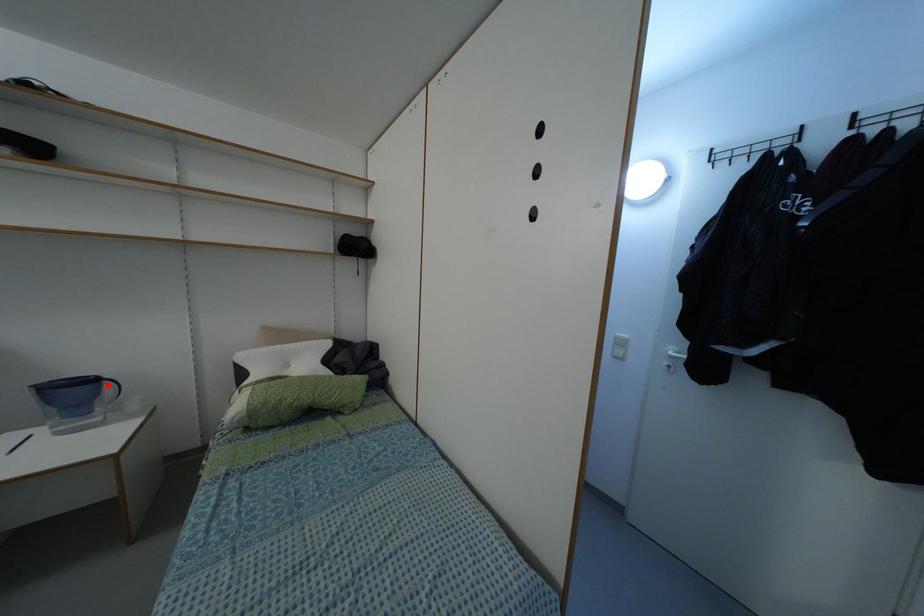
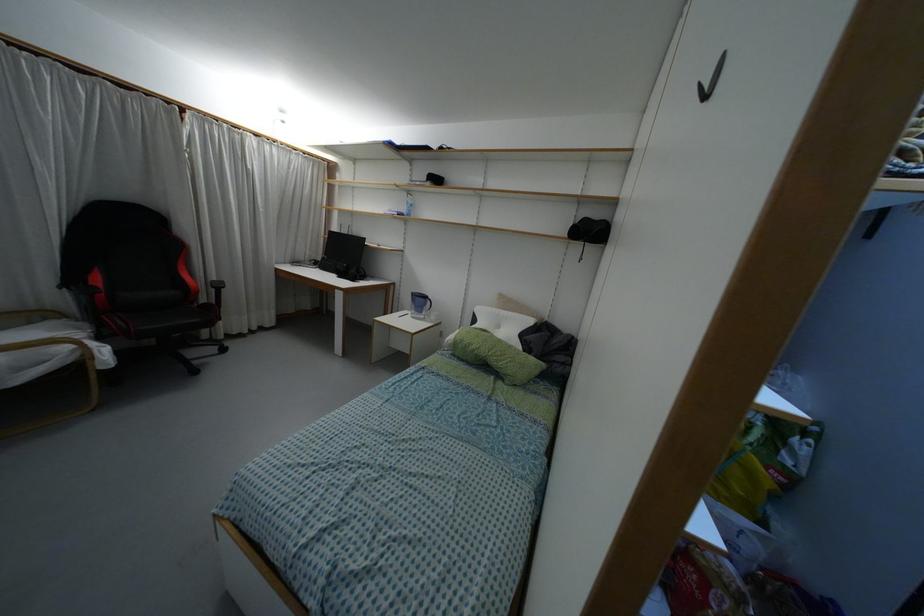
Question: I am providing you with two images of the same scene from different viewpoints. A red point is marked on the first image. Can you still see the location of the red point in image 2?

Choices:
 (A) Yes
 (B) No

Answer: (A)